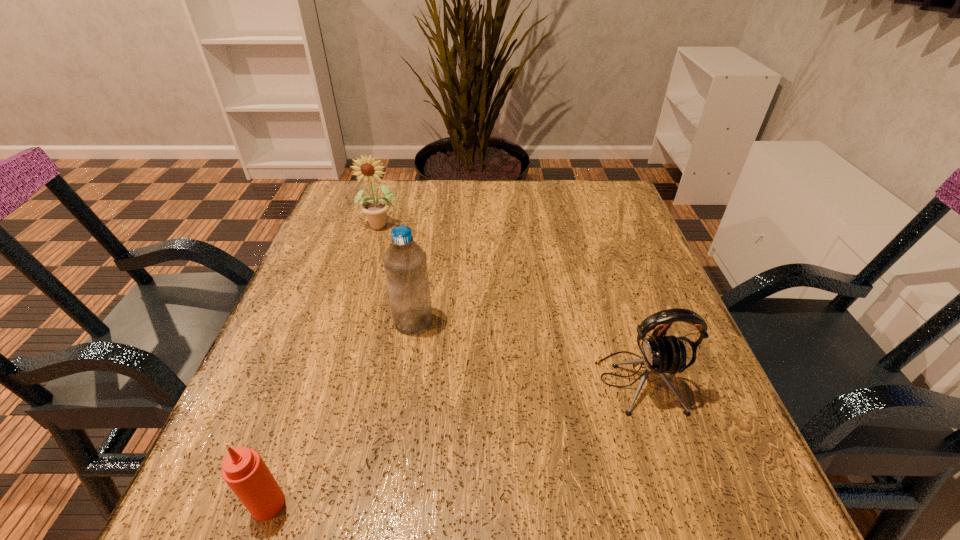
I want to click on vacant space located on the back of the nearest object, so click(336, 308).

Identify the location of object that is at the far edge. (x=367, y=169).

You are a GUI agent. You are given a task and a screenshot of the screen. Output one action in this format:
    pyautogui.click(x=<x>, y=<y>)
    Task: Click on the object at the near edge
    The image size is (960, 540).
    Given the screenshot: What is the action you would take?
    pyautogui.click(x=243, y=469)

Find the location of `sunflower at the left edge`. sunflower at the left edge is located at coordinates (367, 169).

Image resolution: width=960 pixels, height=540 pixels. What are the coordinates of `Tabasco sauce that is at the left edge` in the screenshot? It's located at (243, 469).

The height and width of the screenshot is (540, 960). Identify the location of object at the right edge. (x=660, y=355).

Locate an element on the screen. object positioned at the far left corner is located at coordinates (367, 169).

The width and height of the screenshot is (960, 540). In order to click on object positioned at the near left corner in this screenshot , I will do `click(243, 469)`.

Where is `free space at the far edge`? Image resolution: width=960 pixels, height=540 pixels. free space at the far edge is located at coordinates click(553, 205).

This screenshot has width=960, height=540. Find the location of `vacant region at the near edge`. vacant region at the near edge is located at coordinates (398, 480).